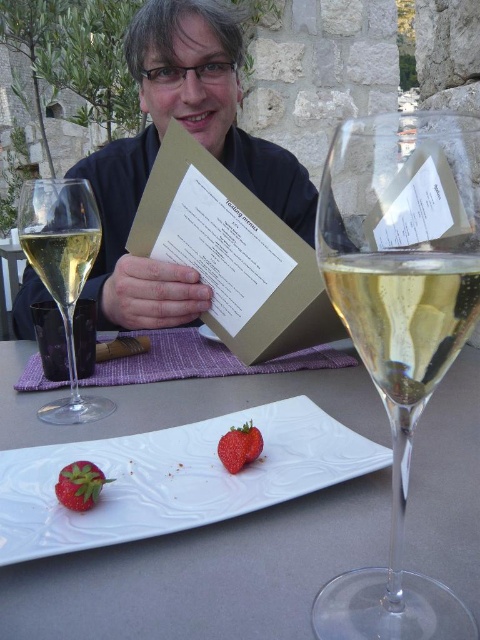
You are a waiter at a restaurant and need to place a new order of strawberries on the table. The table has a white glossy plate at center. Where exactly should you place the strawberries to ensure they are centered on the plate?

The strawberries should be placed at the center of the white glossy plate at center, which is located at coordinates point (204,573).

You are a waiter at this restaurant and need to place a dessert menu on the table without covering any existing items. The dessert menu is small and can be placed anywhere except over the white glossy plate at center or the red matte strawberry at lower center. Based on their positions, where should you place the dessert menu?

The white glossy plate at center is positioned on the right side of the red matte strawberry at lower center. Therefore, placing the dessert menu to the left of the red matte strawberry at lower center or to the left of the white glossy plate at center would keep it clear of both items.

You are a server at the restaurant and need to place a 10cm wide menu on the table without overlapping any existing items. The table has the matte black card at center and the red matte strawberry at lower center. Which item should you avoid placing the menu near to ensure there is enough space?

The matte black card at center has a larger width than the red matte strawberry at lower center, so you should avoid placing the menu near the matte black card at center to ensure there is enough space.